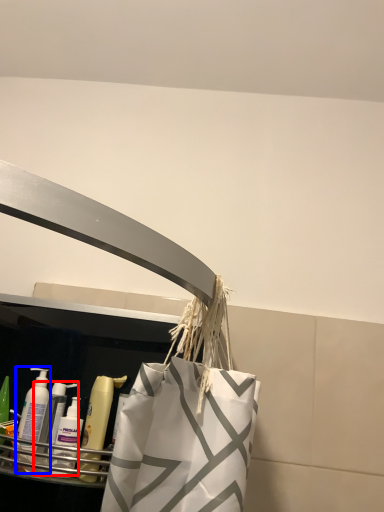
Question: Among these objects, which one is nearest to the camera, cleaning product (highlighted by a red box) or cleaning product (highlighted by a blue box)?

Choices:
 (A) cleaning product
 (B) cleaning product

Answer: (A)